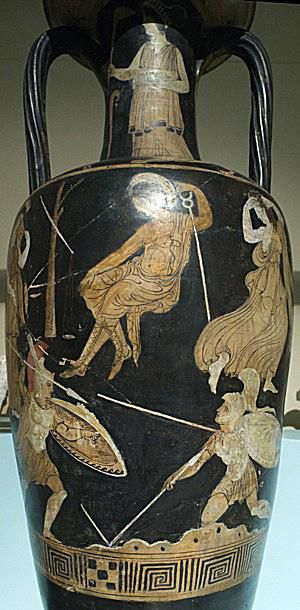
This screenshot has height=610, width=300. Find the location of `antique vase`. antique vase is located at coordinates click(166, 520), click(143, 447), click(39, 73), click(198, 38), click(105, 479), click(119, 110), click(142, 12).